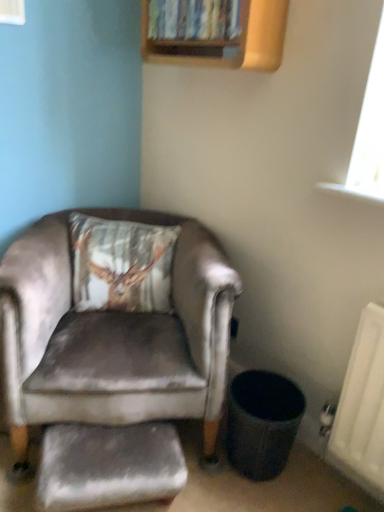
Question: Is satin grey armchair at left situated inside velvet grey footrest at lower left or outside?

Choices:
 (A) inside
 (B) outside

Answer: (B)

Question: Relative to velvet grey footrest at lower left, is satin grey armchair at left in front or behind?

Choices:
 (A) behind
 (B) front

Answer: (B)

Question: Based on their relative distances, which object is farther from the transparent glass window at upper left?

Choices:
 (A) velvet-like brown pillow at upper left
 (B) velvet grey footrest at lower left
 (C) satin grey armchair at left
 (D) wooden bookshelf at upper center

Answer: (B)

Question: Which is farther from the transparent glass window at upper left?

Choices:
 (A) satin grey armchair at left
 (B) wooden bookshelf at upper center
 (C) velvet-like brown pillow at upper left
 (D) velvet grey footrest at lower left

Answer: (D)